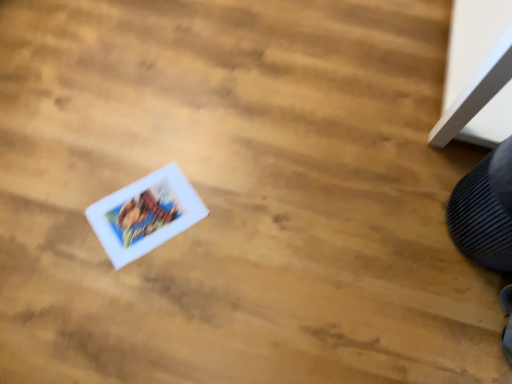
Identify the location of vacant location below white matte comic book at center (from a real-world perspective). (146, 215).